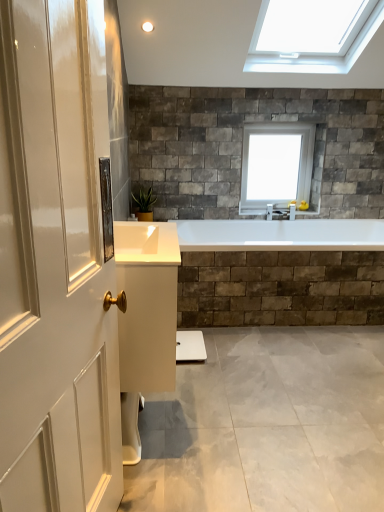
Find the location of a particular element. green glossy plant at lower left is located at coordinates (144, 201).

This screenshot has width=384, height=512. Describe the element at coordinates (144, 201) in the screenshot. I see `green glossy plant at lower left` at that location.

The height and width of the screenshot is (512, 384). Find the location of `transparent glass window at upper center`. transparent glass window at upper center is located at coordinates (276, 164).

Describe the element at coordinates (276, 164) in the screenshot. The image size is (384, 512). I see `transparent glass window at upper center` at that location.

I want to click on green glossy plant at lower left, so click(144, 201).

From the picture: In the image, is transparent glass window at upper center on the left side or the right side of green glossy plant at lower left?

Based on their positions, transparent glass window at upper center is located to the right of green glossy plant at lower left.

Is the position of transparent glass window at upper center less distant than that of green glossy plant at lower left?

No, it is behind green glossy plant at lower left.

Is point (271, 153) more distant than point (137, 198)?

Yes, point (271, 153) is behind point (137, 198).

From the image's perspective, between transparent glass window at upper center and green glossy plant at lower left, who is located below?

From the image's view, green glossy plant at lower left is below.

From a real-world perspective, between transparent glass window at upper center and green glossy plant at lower left, who is vertically higher?

transparent glass window at upper center is physically above.

Consider the image. Considering the sizes of objects transparent glass window at upper center and green glossy plant at lower left in the image provided, who is wider, transparent glass window at upper center or green glossy plant at lower left?

green glossy plant at lower left.

Does transparent glass window at upper center have a lesser height compared to green glossy plant at lower left?

No, transparent glass window at upper center is not shorter than green glossy plant at lower left.

Considering the sizes of objects transparent glass window at upper center and green glossy plant at lower left in the image provided, who is bigger, transparent glass window at upper center or green glossy plant at lower left?

With larger size is transparent glass window at upper center.

Is transparent glass window at upper center completely or partially outside of green glossy plant at lower left?

transparent glass window at upper center is positioned outside green glossy plant at lower left.

Is transparent glass window at upper center in contact with green glossy plant at lower left?

They are not placed beside each other.

Could you tell me if transparent glass window at upper center is turned towards green glossy plant at lower left?

No, transparent glass window at upper center is not aimed at green glossy plant at lower left.

Can you tell me how much transparent glass window at upper center and green glossy plant at lower left differ in facing direction?

There is a 1.51-degree angle between the facing directions of transparent glass window at upper center and green glossy plant at lower left.

The height and width of the screenshot is (512, 384). I want to click on plant that appears below the transparent glass window at upper center (from the image's perspective), so click(x=144, y=201).

Considering the relative positions of green glossy plant at lower left and transparent glass window at upper center in the image provided, is green glossy plant at lower left to the right of transparent glass window at upper center from the viewer's perspective?

Incorrect, green glossy plant at lower left is not on the right side of transparent glass window at upper center.

Which object is more forward, green glossy plant at lower left or transparent glass window at upper center?

green glossy plant at lower left is closer to the camera.

Is point (147, 200) closer or farther from the camera than point (296, 145)?

Point (147, 200) is closer to the camera than point (296, 145).

From the image's perspective, is green glossy plant at lower left located beneath transparent glass window at upper center?

Yes, from the image's perspective, green glossy plant at lower left is below transparent glass window at upper center.

From a real-world perspective, is green glossy plant at lower left positioned over transparent glass window at upper center based on gravity?

No, from a real-world perspective, green glossy plant at lower left is not above transparent glass window at upper center.

Considering the sizes of green glossy plant at lower left and transparent glass window at upper center in the image, is green glossy plant at lower left wider or thinner than transparent glass window at upper center?

Considering their sizes, green glossy plant at lower left looks broader than transparent glass window at upper center.

Between green glossy plant at lower left and transparent glass window at upper center, which one has less height?

Standing shorter between the two is green glossy plant at lower left.

Can you confirm if green glossy plant at lower left is smaller than transparent glass window at upper center?

Yes, green glossy plant at lower left is smaller than transparent glass window at upper center.

Is green glossy plant at lower left not within transparent glass window at upper center?

Yes, green glossy plant at lower left is located beyond the bounds of transparent glass window at upper center.

Is green glossy plant at lower left directly adjacent to transparent glass window at upper center?

No, green glossy plant at lower left is not making contact with transparent glass window at upper center.

From the picture: Is green glossy plant at lower left oriented away from transparent glass window at upper center?

No, green glossy plant at lower left is not facing the opposite direction of transparent glass window at upper center.

Can you tell me how much green glossy plant at lower left and transparent glass window at upper center differ in facing direction?

They differ by 1.51 degrees in their facing directions.

How distant is green glossy plant at lower left from transparent glass window at upper center?

green glossy plant at lower left and transparent glass window at upper center are 3.46 feet apart.

Locate an element on the screen. plant below the transparent glass window at upper center (from a real-world perspective) is located at coordinates (144, 201).

Find the location of a particular element. This screenshot has width=384, height=512. plant below the transparent glass window at upper center (from the image's perspective) is located at coordinates (x=144, y=201).

This screenshot has height=512, width=384. What are the coordinates of `window that appears behind the green glossy plant at lower left` in the screenshot? It's located at (276, 164).